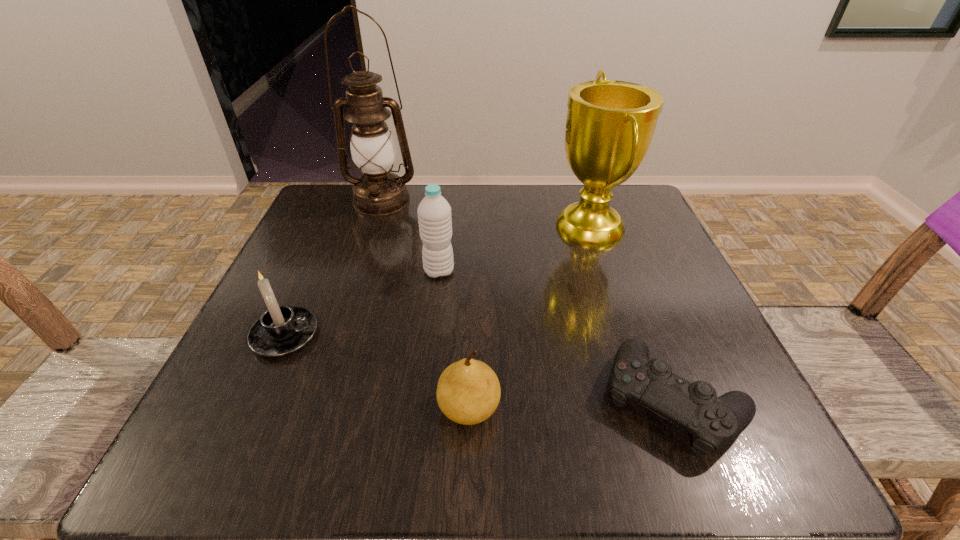
Image resolution: width=960 pixels, height=540 pixels. I want to click on award present at the right edge, so click(610, 124).

Find the location of a particular element. This screenshot has width=960, height=540. control present at the right edge is located at coordinates (714, 422).

The image size is (960, 540). Find the location of `object located at the far left corner`. object located at the far left corner is located at coordinates (379, 192).

I want to click on object that is at the far right corner, so click(610, 124).

Locate an element on the screen. The height and width of the screenshot is (540, 960). object that is at the near right corner is located at coordinates (714, 422).

The image size is (960, 540). In order to click on free spot at the far edge of the desktop in this screenshot , I will do `click(526, 191)`.

Locate an element on the screen. Image resolution: width=960 pixels, height=540 pixels. free space at the left edge is located at coordinates (361, 264).

The image size is (960, 540). Find the location of `vacant position at the right edge of the desktop`. vacant position at the right edge of the desktop is located at coordinates (x=672, y=340).

Locate an element on the screen. vacant space at the far right corner of the desktop is located at coordinates (651, 240).

I want to click on vacant space at the near right corner of the desktop, so click(744, 451).